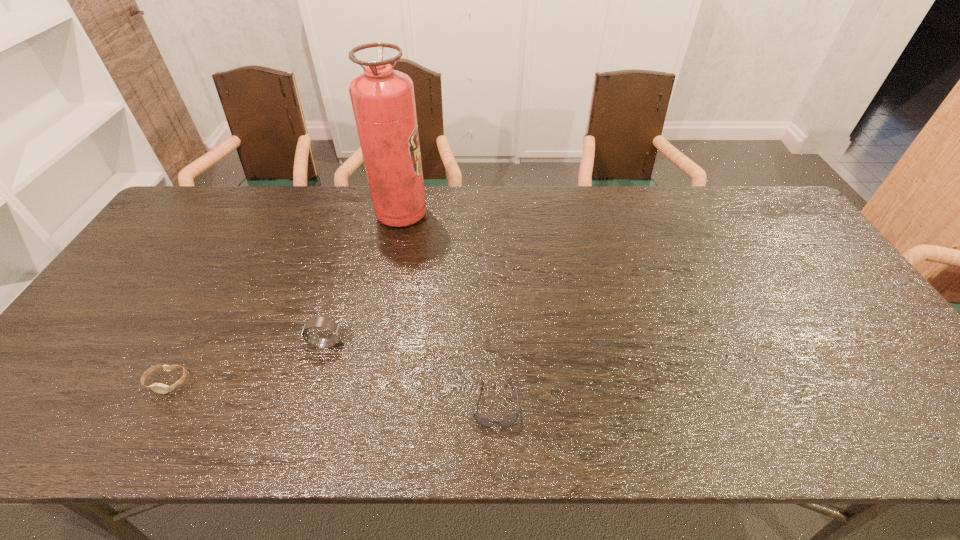
Locate an element on the screen. This screenshot has height=540, width=960. vacant region that satisfies the following two spatial constraints: 1. on the label side of the tallest object; 2. on the face of the shorter watch is located at coordinates (369, 382).